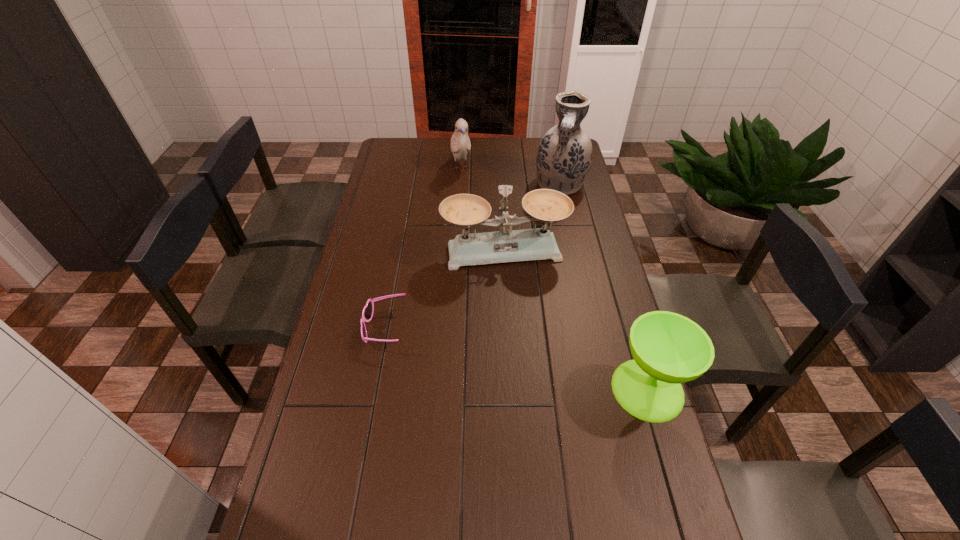
Where is `sunglasses`? sunglasses is located at coordinates (367, 313).

At what (x,y) coordinates should I click in order to perform the action: click on the second nearest object. Please return your answer as a coordinate pair (x, y). Looking at the image, I should click on (367, 313).

Find the location of a particular element. Image resolution: width=960 pixels, height=540 pixels. the second shortest object is located at coordinates tap(668, 349).

At what (x,y) coordinates should I click in order to perform the action: click on wineglass. Please return your answer as a coordinate pair (x, y). The height and width of the screenshot is (540, 960). Looking at the image, I should click on (668, 349).

This screenshot has width=960, height=540. I want to click on vase, so click(x=564, y=155).

You are a GUI agent. You are given a task and a screenshot of the screen. Output one action in this format:
    pyautogui.click(x=<x>, y=<y>)
    Task: Click on the third nearest object
    
    Given the screenshot: What is the action you would take?
    pyautogui.click(x=546, y=205)

In order to click on bird in this screenshot , I will do `click(460, 143)`.

This screenshot has width=960, height=540. In order to click on vacant region located on the front-facing side of the sunglasses in this screenshot , I will do `click(346, 328)`.

Where is `vacant area located on the left of the second shortest object`? vacant area located on the left of the second shortest object is located at coordinates click(509, 389).

Locate an element on the screen. vacant space located with the handle on the side of the vase is located at coordinates (546, 264).